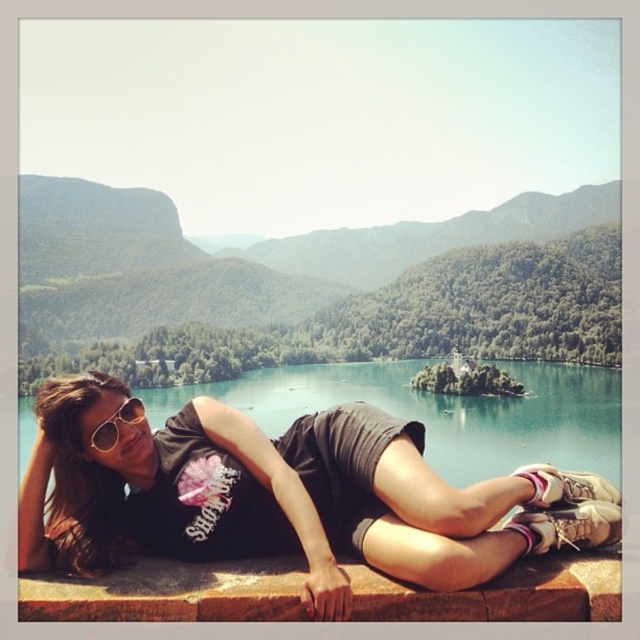
Question: Among these points, which one is nearest to the camera?

Choices:
 (A) (113, 435)
 (B) (422, 241)

Answer: (A)

Question: Which object is closer to the camera taking this photo?

Choices:
 (A) matte black shirt at center
 (B) brown stone ledge at lower center
 (C) green forested mountain at upper center

Answer: (B)

Question: Estimate the real-world distances between objects in this image. Which object is farther from the matte black shirt at center?

Choices:
 (A) green forested mountain at upper center
 (B) sunglasses at center
 (C) brown stone ledge at lower center

Answer: (A)

Question: Does matte black shirt at center come behind brown stone ledge at lower center?

Choices:
 (A) yes
 (B) no

Answer: (A)

Question: Where is green forested mountain at upper center located in relation to brown stone ledge at lower center in the image?

Choices:
 (A) above
 (B) below

Answer: (A)

Question: Is green forested mountain at upper center to the left of sunglasses at center from the viewer's perspective?

Choices:
 (A) no
 (B) yes

Answer: (A)